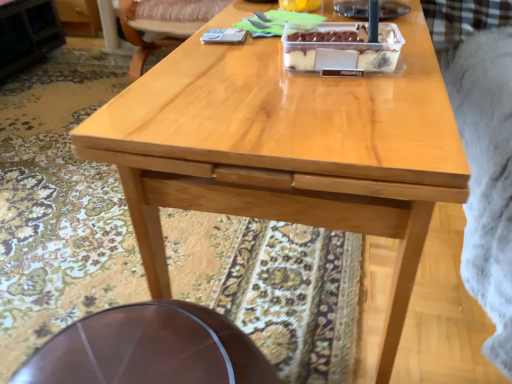
Question: From their relative heights in the image, would you say wooden chair at upper center is taller or shorter than translucent plastic container at center?

Choices:
 (A) tall
 (B) short

Answer: (A)

Question: Is wooden chair at upper center situated inside translucent plastic container at center or outside?

Choices:
 (A) outside
 (B) inside

Answer: (A)

Question: Which object is the closest to the shiny brown table at lower center?

Choices:
 (A) translucent plastic container at center
 (B) wooden chair at upper center

Answer: (A)

Question: Which object is positioned closest to the wooden chair at upper center?

Choices:
 (A) translucent plastic container at center
 (B) shiny brown table at lower center

Answer: (A)